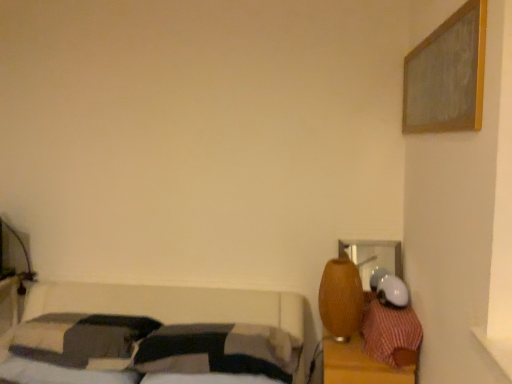
Locate an element on the screen. This screenshot has height=384, width=512. vacant area that is in front of braided wood table lamp at right is located at coordinates (345, 353).